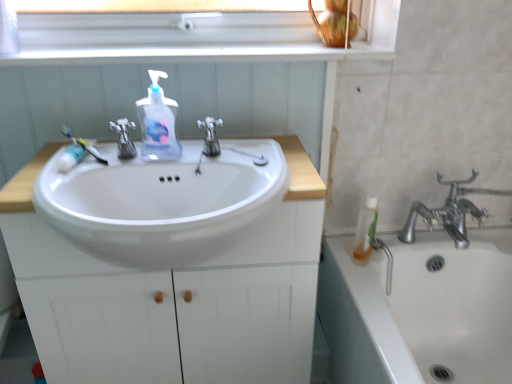
This screenshot has height=384, width=512. I want to click on vacant space to the left of white plastic toothbrush at left, so click(x=42, y=157).